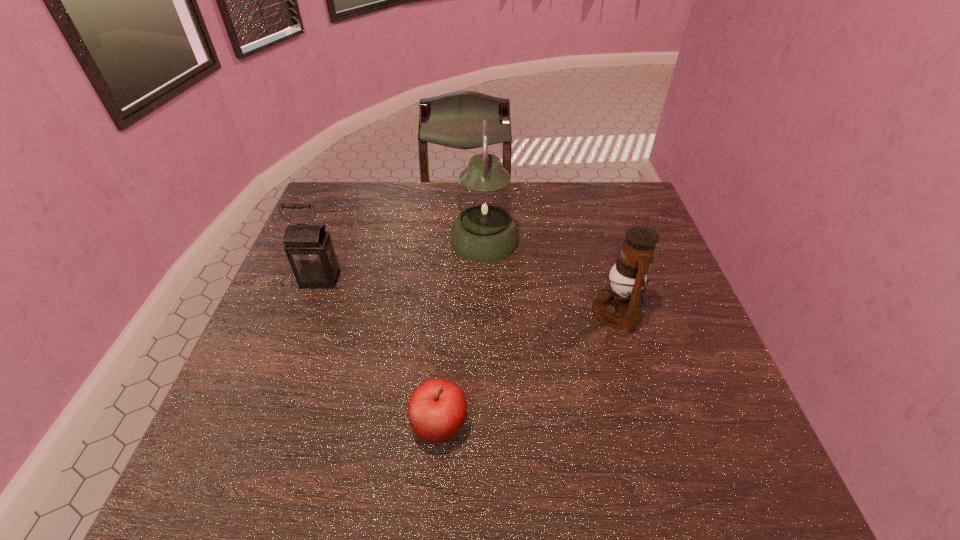
This screenshot has width=960, height=540. In order to click on the farthest lantern in this screenshot , I will do `click(484, 231)`.

Where is `the farthest object`? the farthest object is located at coordinates (484, 231).

Where is `the third shortest object`? This screenshot has width=960, height=540. the third shortest object is located at coordinates (619, 306).

Locate an element on the screen. This screenshot has width=960, height=540. the rightmost object is located at coordinates (619, 306).

Where is `the third tallest object`? This screenshot has width=960, height=540. the third tallest object is located at coordinates (309, 249).

Identify the location of the shortest lantern. The height and width of the screenshot is (540, 960). (309, 249).

Locate an element on the screen. apple is located at coordinates point(437,408).

This screenshot has width=960, height=540. Find the location of `the shortest object`. the shortest object is located at coordinates [x=437, y=408].

Locate an element on the screen. The width and height of the screenshot is (960, 540). vacant space located on the front of the farthest lantern is located at coordinates (486, 382).

You are a GUI agent. You are given a task and a screenshot of the screen. Output one action in this format:
    pyautogui.click(x=<x>, y=<y>)
    Task: Click on the free spot located on the side of the rightmost lantern, there is a wick adjustment knob
    The height and width of the screenshot is (540, 960).
    Given the screenshot: What is the action you would take?
    pyautogui.click(x=528, y=310)